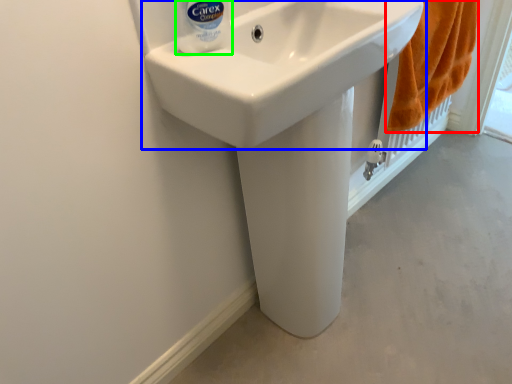
Question: Which object is the farthest from bath towel (highlighted by a red box)? Choose among these: sink (highlighted by a blue box) or cleaning product (highlighted by a green box).

Choices:
 (A) sink
 (B) cleaning product

Answer: (B)